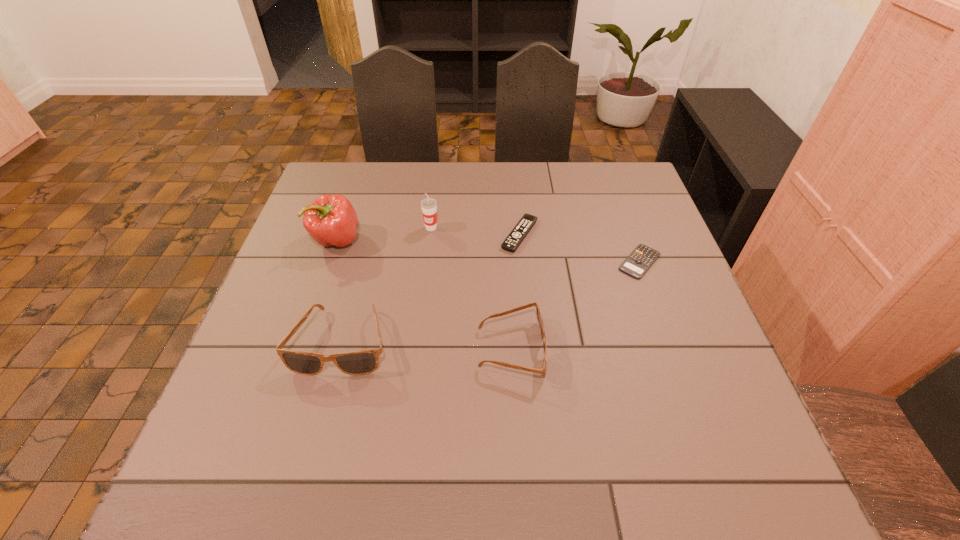
I want to click on vacant space at the right edge of the desktop, so click(664, 303).

Identify the location of vacant area at the far left corner of the desktop. The image size is (960, 540). (352, 172).

The height and width of the screenshot is (540, 960). Identify the location of unoccupied area between the remote control and the pepper. (428, 237).

The image size is (960, 540). I want to click on free spot between the pepper and the right sunglasses, so click(x=423, y=294).

Where is `unoccupied area between the shorter sunglasses and the fourth object from right to left`? The image size is (960, 540). unoccupied area between the shorter sunglasses and the fourth object from right to left is located at coordinates (471, 288).

The height and width of the screenshot is (540, 960). Identify the location of unoccupied position between the cup and the third tallest object. (387, 285).

Locate an element on the screen. This screenshot has height=540, width=960. vacant area that lies between the third object from left to right and the taller sunglasses is located at coordinates (387, 285).

You are a GUI agent. You are given a task and a screenshot of the screen. Output one action in this format:
    pyautogui.click(x=<x>, y=<y>)
    Task: Click on the vacant region between the rightmost object and the remote control
    The image size is (960, 540).
    Given the screenshot: What is the action you would take?
    pyautogui.click(x=580, y=248)

Identify the location of free spot between the third tallest object and the third object from left to right. Image resolution: width=960 pixels, height=540 pixels. (387, 285).

In order to click on free space between the pepper and the shorter sunglasses in this screenshot , I will do `click(423, 294)`.